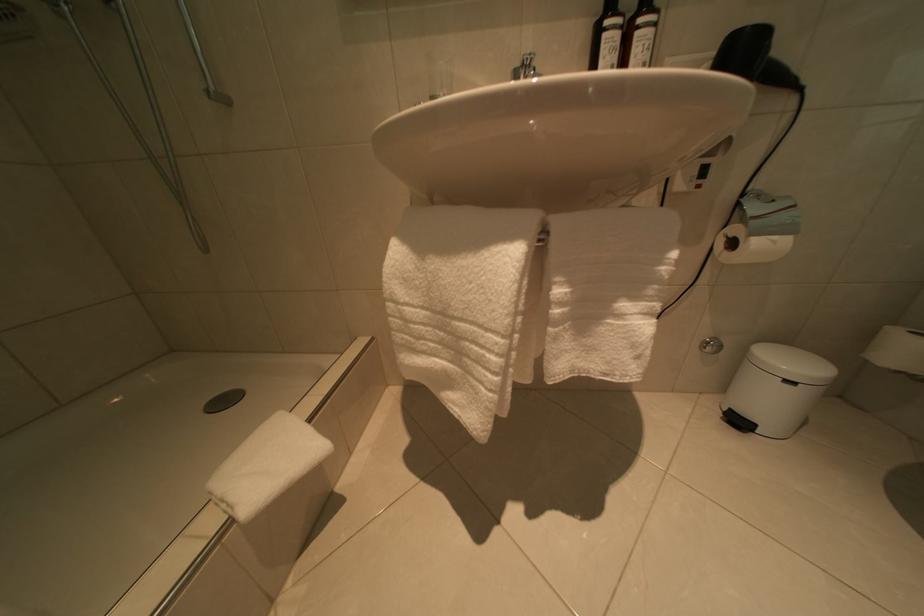
The image size is (924, 616). What do you see at coordinates (737, 421) in the screenshot?
I see `a black trash can pedal` at bounding box center [737, 421].